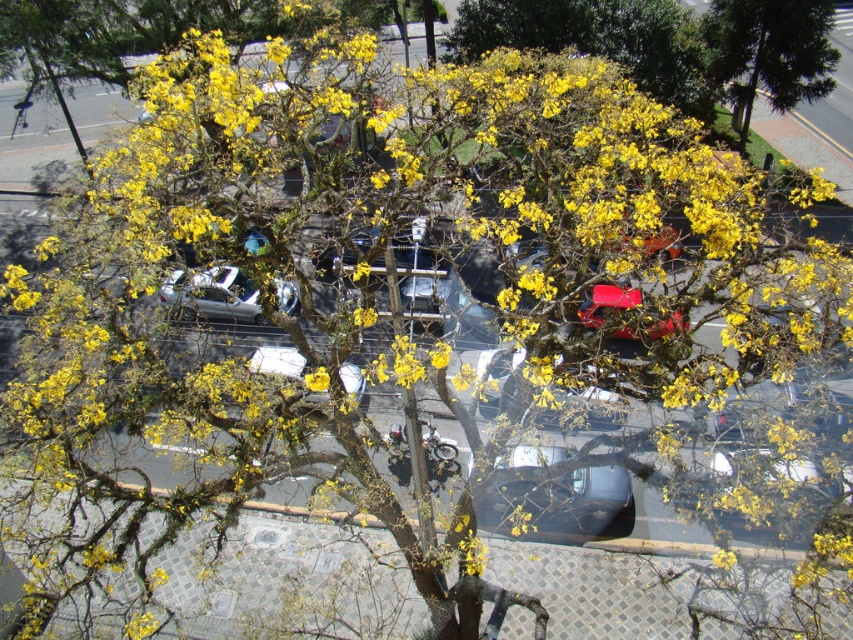
Question: Which of the following is the closest to the observer?

Choices:
 (A) (x=213, y=273)
 (B) (x=621, y=328)
 (C) (x=720, y=61)
 (D) (x=523, y=483)

Answer: (B)

Question: Which object is closer to the camera taking this photo?

Choices:
 (A) satin silver car at center
 (B) shiny red car at center
 (C) metallic silver car at center
 (D) green textured pine tree at upper right

Answer: (A)

Question: Can you confirm if green textured pine tree at upper right is positioned below shiny red car at center?

Choices:
 (A) yes
 (B) no

Answer: (B)

Question: Does green textured pine tree at upper right appear under satin silver car at center?

Choices:
 (A) no
 (B) yes

Answer: (A)

Question: Based on their relative distances, which object is farther from the green textured pine tree at upper right?

Choices:
 (A) satin silver car at center
 (B) metallic silver car at center

Answer: (A)

Question: Is green textured pine tree at upper right closer to camera compared to shiny red car at center?

Choices:
 (A) yes
 (B) no

Answer: (B)